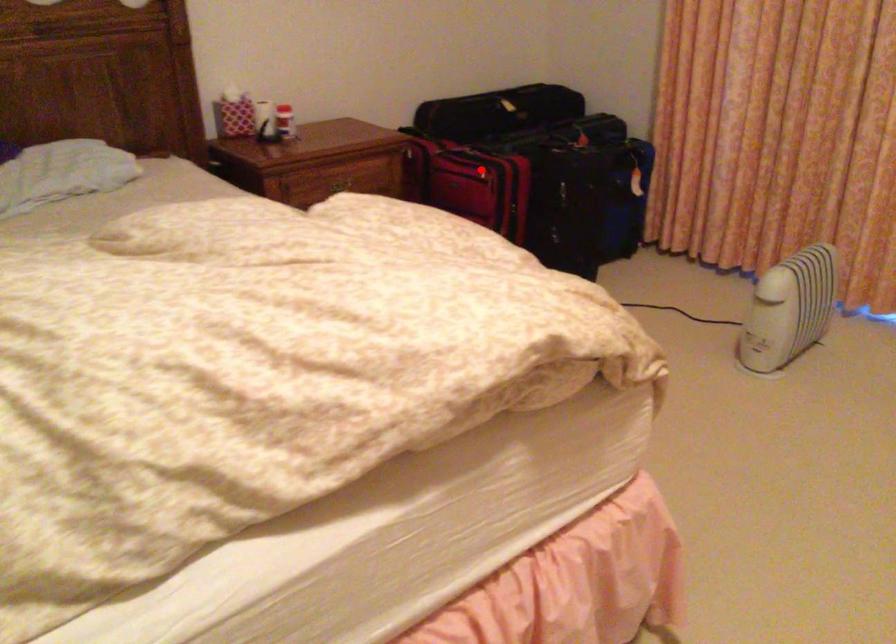
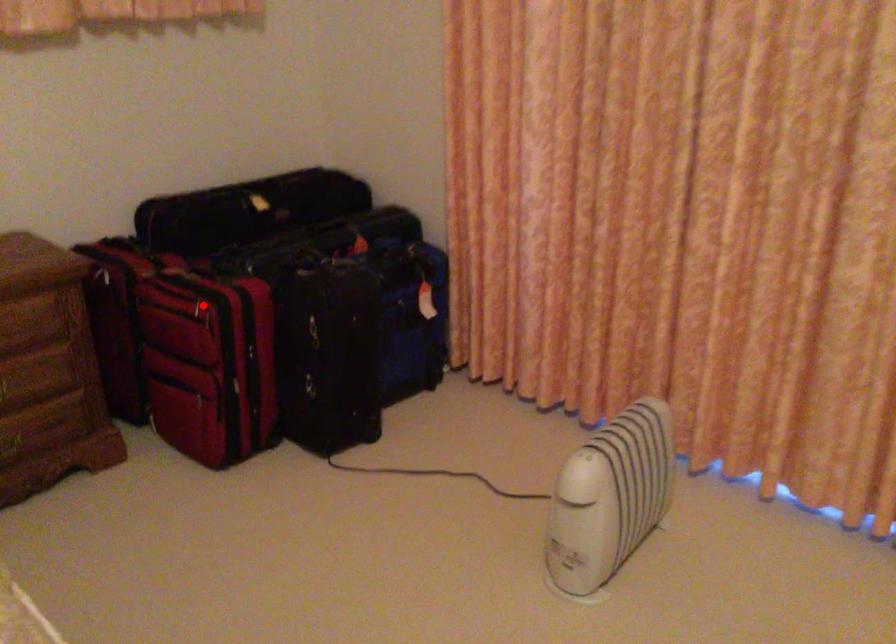
I am providing you with two images of the same scene from different viewpoints. A red point is marked on the first image and another point is marked on the second image. Are the points marked in image1 and image2 representing the same 3D position?

Yes